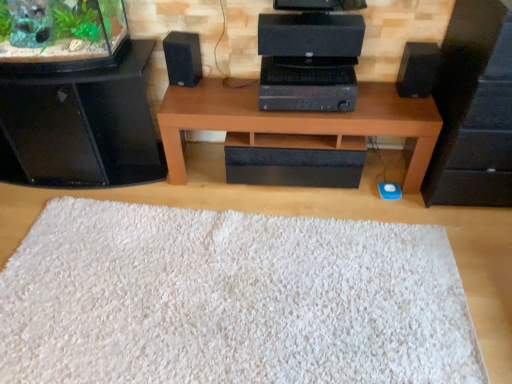
Where is `free space in front of black matte speaker at left, the second speaker when ordered from right to left`? The height and width of the screenshot is (384, 512). free space in front of black matte speaker at left, the second speaker when ordered from right to left is located at coordinates (187, 101).